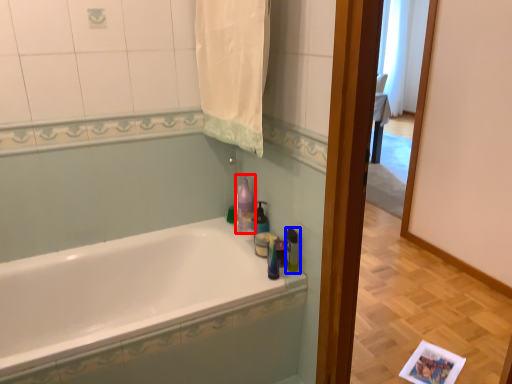
Question: Which object appears closest to the camera in this image, cleaning product (highlighted by a red box) or toiletry (highlighted by a blue box)?

Choices:
 (A) cleaning product
 (B) toiletry

Answer: (B)